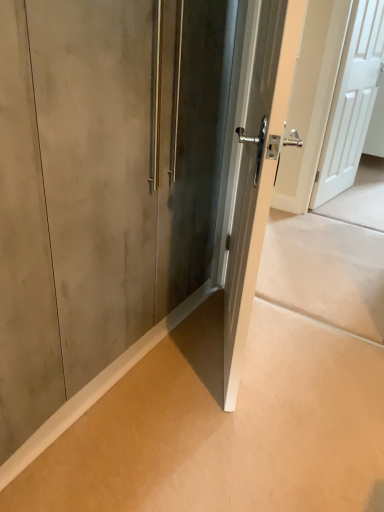
Locate an element on the screen. Image resolution: width=384 pixels, height=512 pixels. blank space situated above matte concrete wall at lower left (from a real-world perspective) is located at coordinates (202, 414).